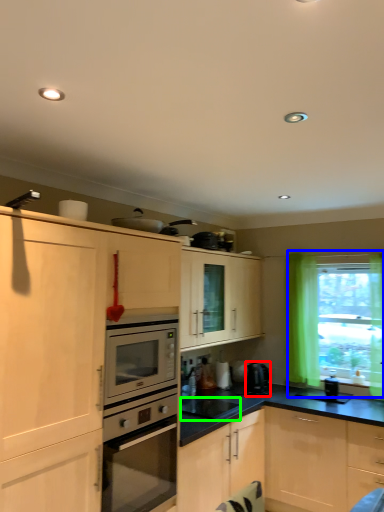
Question: Based on their relative distances, which object is nearer to coffee machine (highlighted by a red box)? Choose from window (highlighted by a blue box) and appliance (highlighted by a green box).

Choices:
 (A) window
 (B) appliance

Answer: (B)